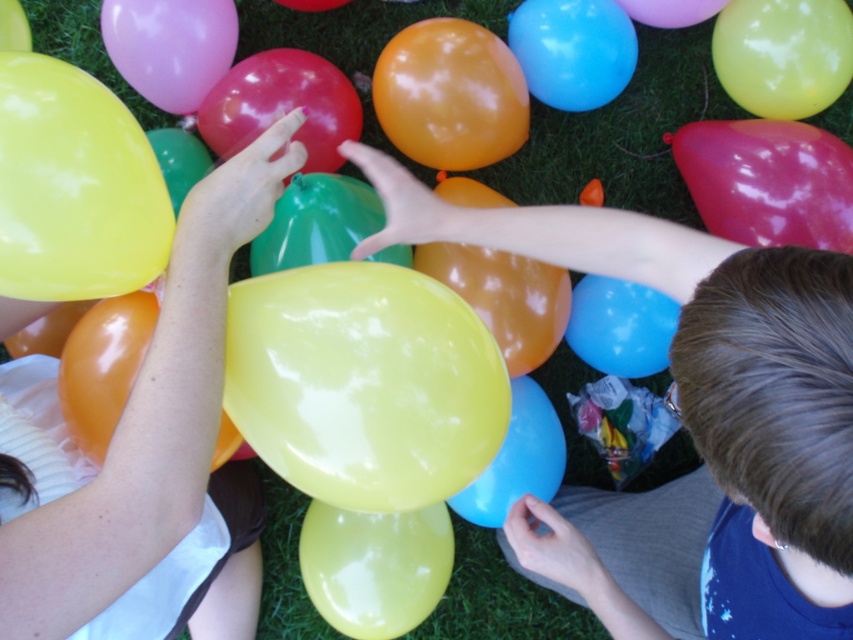
Question: Can you confirm if glossy orange balloon at center is wider than matte yellow balloon at center?

Choices:
 (A) no
 (B) yes

Answer: (B)

Question: Does smooth yellow balloon at upper left have a greater width compared to glossy orange balloon at center?

Choices:
 (A) no
 (B) yes

Answer: (B)

Question: Which point is closer to the camera?

Choices:
 (A) smooth yellow balloon at upper left
 (B) smooth yellow balloon at center
 (C) glossy orange balloon at center
 (D) matte yellow balloon at center

Answer: (B)

Question: Which point is farther to the camera?

Choices:
 (A) smooth yellow balloon at center
 (B) yellow glossy balloon at upper left
 (C) smooth yellow balloon at upper left

Answer: (B)

Question: Which object is farther from the camera taking this photo?

Choices:
 (A) matte yellow balloon at center
 (B) yellow glossy balloon at upper left

Answer: (A)

Question: Is smooth yellow balloon at center above matte yellow balloon at center?

Choices:
 (A) yes
 (B) no

Answer: (B)